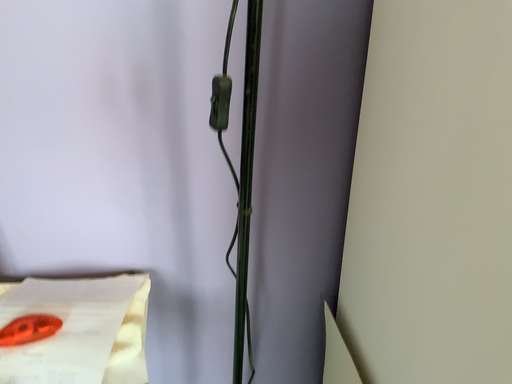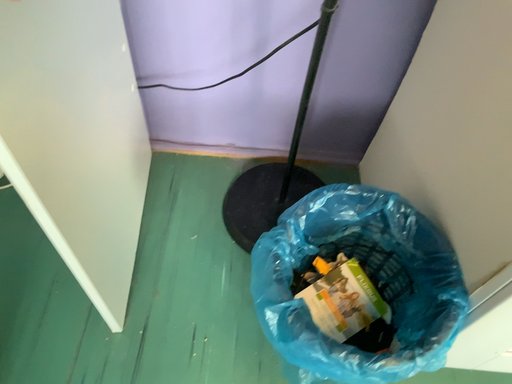
Question: Which way did the camera rotate in the video?

Choices:
 (A) rotated upward
 (B) rotated downward

Answer: (B)